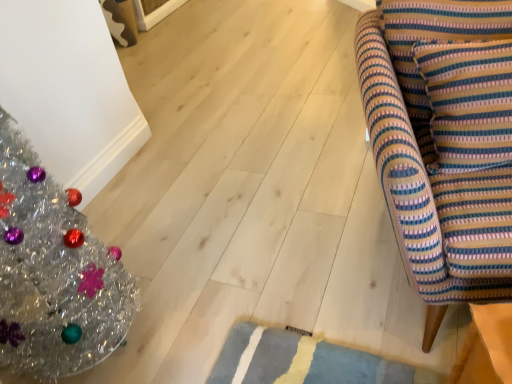
Question: Is point (62, 236) positioned closer to the camera than point (394, 218)?

Choices:
 (A) farther
 (B) closer

Answer: (A)

Question: Would you say shiny silver christmas tree at left is to the left or to the right of striped fabric armchair at right in the picture?

Choices:
 (A) left
 (B) right

Answer: (A)

Question: Estimate the real-world distances between objects in this image. Which object is closer to the striped fabric cushion at right?

Choices:
 (A) striped fabric armchair at right
 (B) shiny silver christmas tree at left

Answer: (A)

Question: Which is nearer to the shiny silver christmas tree at left?

Choices:
 (A) striped fabric cushion at right
 (B) striped fabric armchair at right

Answer: (B)